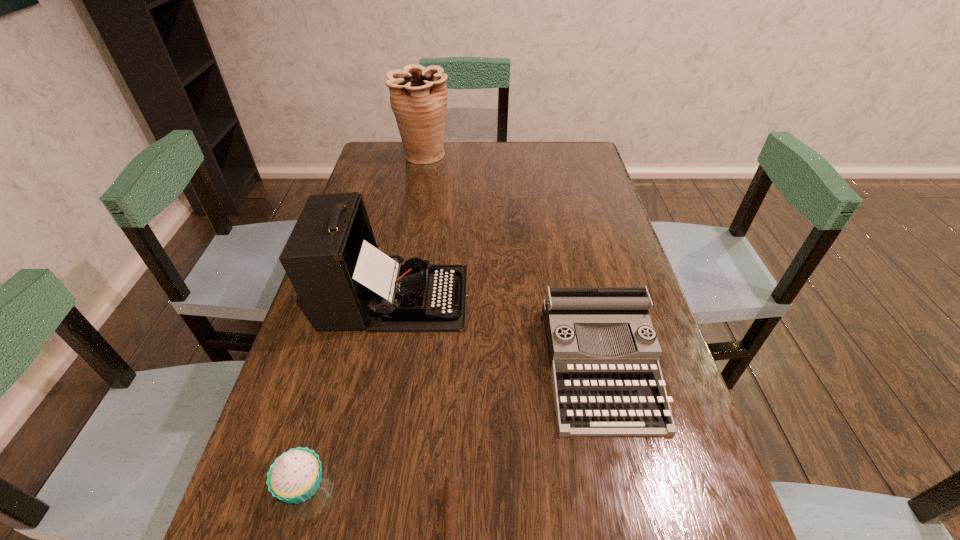
Image resolution: width=960 pixels, height=540 pixels. I want to click on the farthest object, so click(418, 96).

At what (x,y) coordinates should I click in order to perform the action: click on the left typewriter. Please return your answer as a coordinate pair (x, y). Image resolution: width=960 pixels, height=540 pixels. Looking at the image, I should click on (331, 257).

Where is `the shorter typewriter`? the shorter typewriter is located at coordinates (603, 351).

Locate an element on the screen. the rightmost object is located at coordinates (603, 351).

The image size is (960, 540). What are the coordinates of `cupcake` in the screenshot? It's located at (295, 476).

Image resolution: width=960 pixels, height=540 pixels. Identify the location of free location located on the front of the farthest object. (417, 197).

Where is `vacant area situated 0.290m inside the open case of the taller typewriter`? Image resolution: width=960 pixels, height=540 pixels. vacant area situated 0.290m inside the open case of the taller typewriter is located at coordinates (584, 297).

The width and height of the screenshot is (960, 540). What are the coordinates of `free space located on the typing side of the shorter typewriter` in the screenshot? It's located at (630, 491).

Find the location of a particular element. This screenshot has height=540, width=960. vacant point located 0.050m on the back of the cupcake is located at coordinates (316, 433).

Locate an element on the screen. object that is at the far edge is located at coordinates (418, 96).